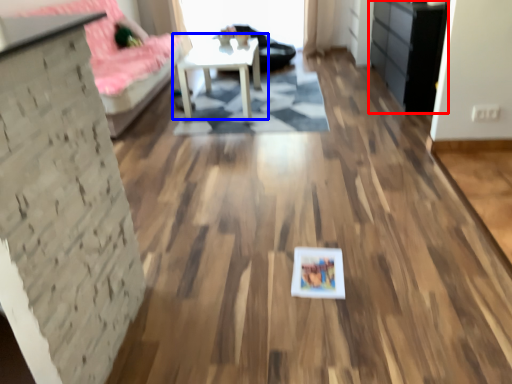
Question: Which of the following is the farthest to the observer, dresser (highlighted by a red box) or table (highlighted by a blue box)?

Choices:
 (A) dresser
 (B) table

Answer: (B)